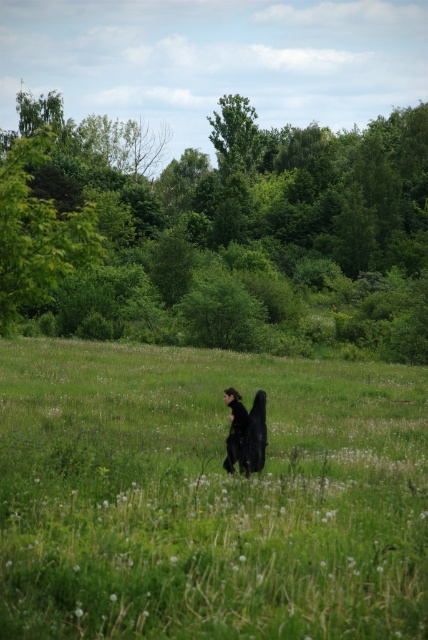
Who is shorter, green grass at center or green leafy tree at center?

With less height is green grass at center.

Is point (339, 371) closer to camera compared to point (344, 198)?

Yes, it is.

This screenshot has height=640, width=428. What do you see at coordinates (208, 497) in the screenshot?
I see `green grass at center` at bounding box center [208, 497].

Where is `green grass at center`? green grass at center is located at coordinates (208, 497).

Describe the element at coordinates (208, 497) in the screenshot. Image resolution: width=428 pixels, height=640 pixels. I see `green grass at center` at that location.

Between green grass at center and green leafy tree at left, which one appears on the left side from the viewer's perspective?

green leafy tree at left

Describe the element at coordinates (208, 497) in the screenshot. The width and height of the screenshot is (428, 640). I see `green grass at center` at that location.

Find the location of `green grass at center`. green grass at center is located at coordinates (208, 497).

Can you confirm if green leafy tree at center is wider than green leafy tree at left?

Yes.

Does green leafy tree at center have a lesser height compared to green leafy tree at left?

Incorrect, green leafy tree at center's height does not fall short of green leafy tree at left's.

Looking at this image, who is more distant from viewer, (x=42, y=209) or (x=89, y=260)?

The point (x=89, y=260) is more distant.

Find the location of `green leafy tree at center`. green leafy tree at center is located at coordinates (222, 232).